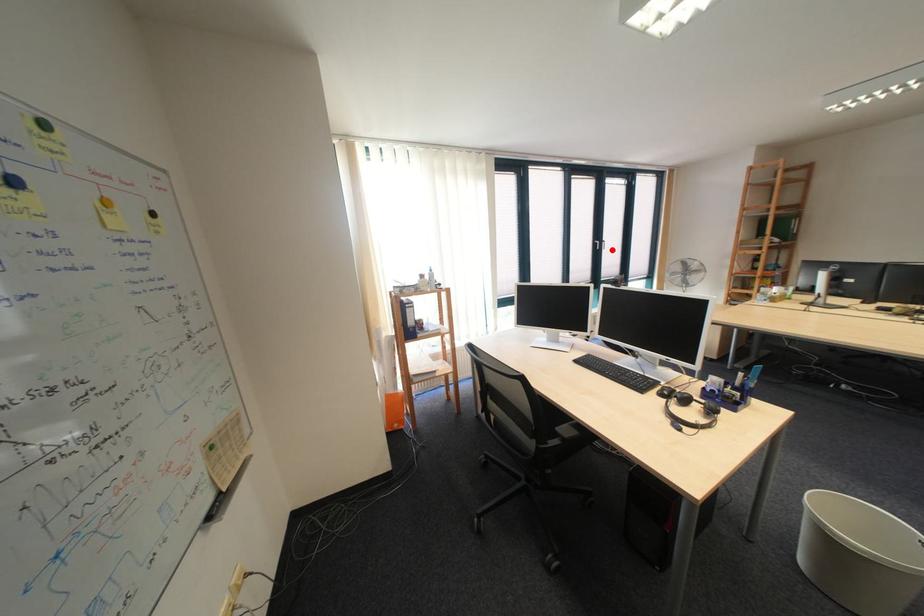
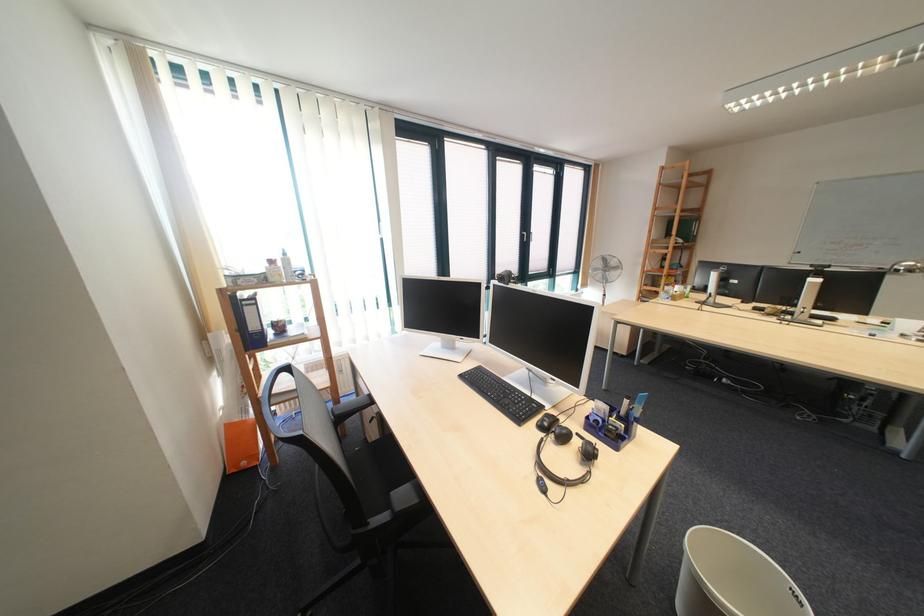
The point at the highlighted location is marked in the first image. Where is the corresponding point in the second image?

(540, 241)